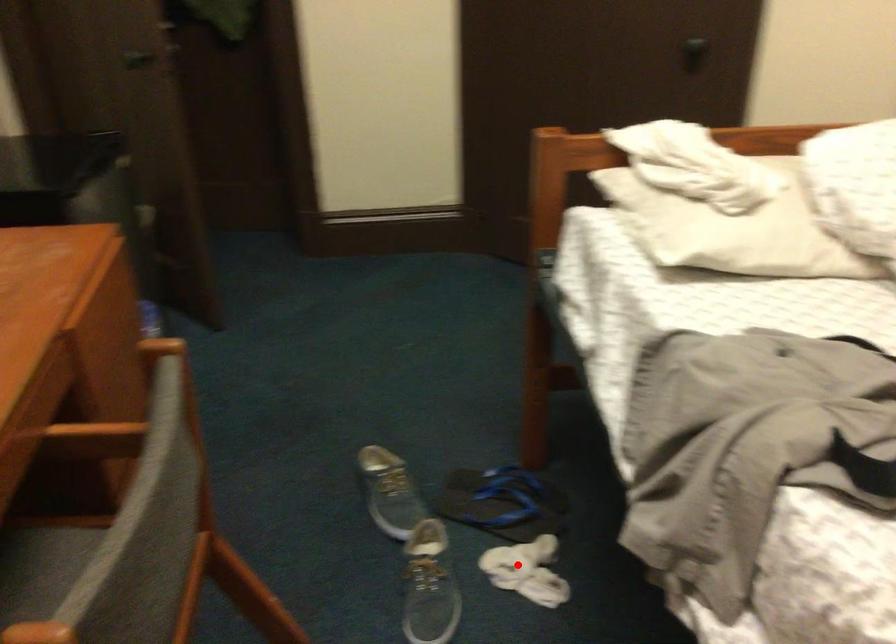
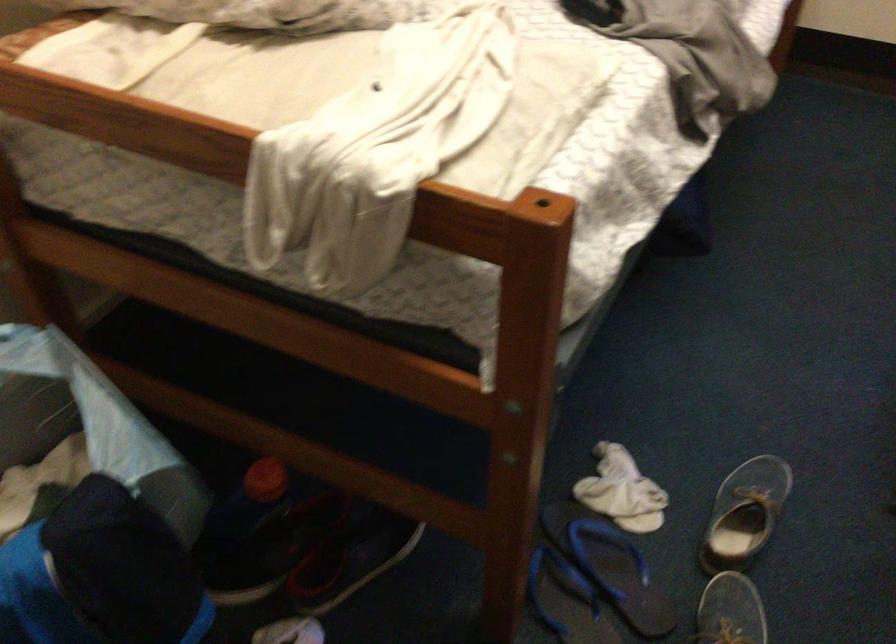
Question: I am providing you with two images of the same scene from different viewpoints. In image1, a red point is highlighted. Considering the same 3D point in image2, which of the following is correct?

Choices:
 (A) It is closer
 (B) It is farther

Answer: (A)